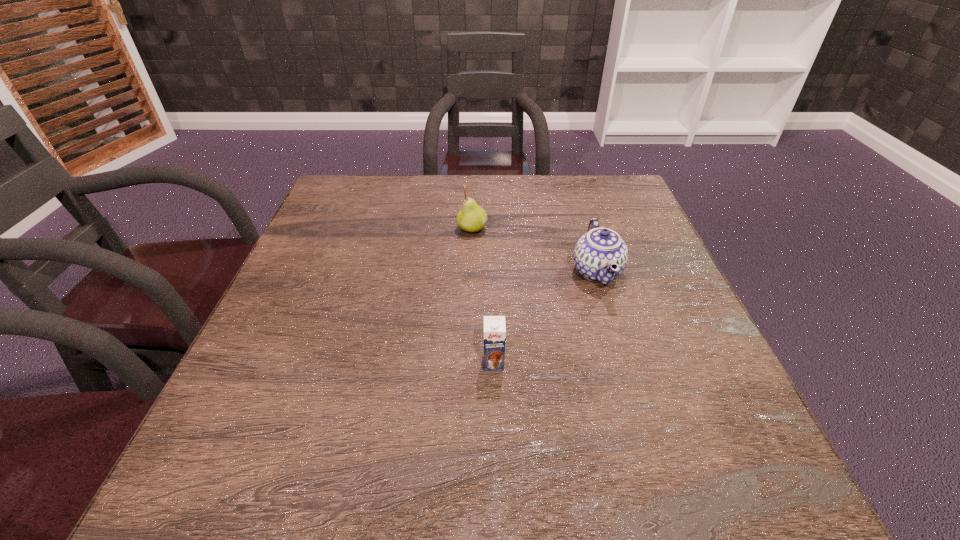
Identify the location of free space at the far edge. (389, 208).

In the image, there is a desktop. In order to click on free space at the left edge in this screenshot , I will do `click(332, 255)`.

At what (x,y) coordinates should I click in order to perform the action: click on free spot at the right edge of the desktop. Please return your answer as a coordinate pair (x, y). This screenshot has width=960, height=540. Looking at the image, I should click on (734, 394).

At what (x,y) coordinates should I click in order to perform the action: click on vacant point at the far left corner. Please return your answer as a coordinate pair (x, y). The width and height of the screenshot is (960, 540). Looking at the image, I should click on (383, 194).

Find the location of a particular element. Image resolution: width=960 pixels, height=540 pixels. blank region between the pear and the nearest object is located at coordinates (483, 296).

The height and width of the screenshot is (540, 960). I want to click on free space between the pear and the rightmost object, so click(x=535, y=250).

Where is `blank region between the rightmost object and the chocolate milk`? This screenshot has width=960, height=540. blank region between the rightmost object and the chocolate milk is located at coordinates (545, 318).

Locate an element on the screen. This screenshot has height=540, width=960. vacant space that's between the pear and the nearest object is located at coordinates (483, 296).

This screenshot has height=540, width=960. I want to click on unoccupied position between the pear and the chinaware, so click(535, 250).

Image resolution: width=960 pixels, height=540 pixels. What are the coordinates of `vacant point located between the second farthest object and the nearest object` in the screenshot? It's located at (545, 318).